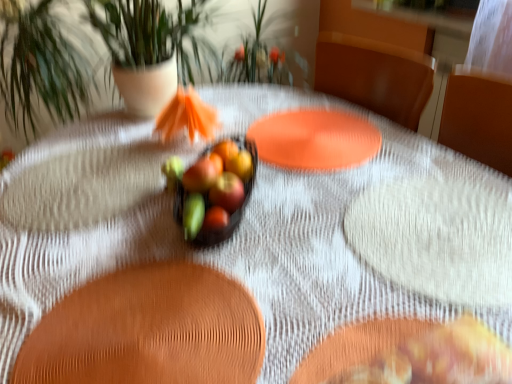
In order to click on free location to the right of glossy red apple at center, which is counted as the 1th fruit, starting from the front in this screenshot , I will do `click(308, 250)`.